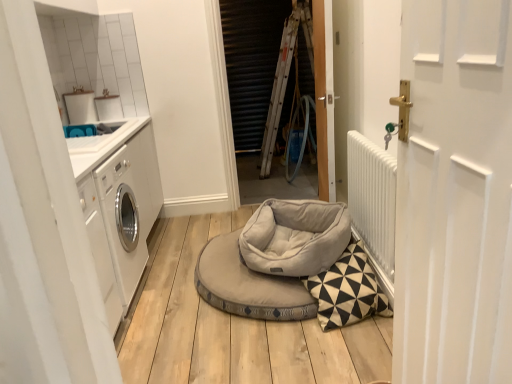
Locate an element on the screen. This screenshot has width=512, height=384. white glossy washing machine at left is located at coordinates (120, 210).

Find the location of a particular element. Image resolution: width=512 pixels, height=384 pixels. light gray plush dog bed at center, which is the second dog bed from bottom to top is located at coordinates (295, 237).

This screenshot has width=512, height=384. Describe the element at coordinates (324, 97) in the screenshot. I see `wooden door at center, the first door from the back` at that location.

This screenshot has width=512, height=384. What are the coordinates of `light gray fabric dog bed at center, the second dog bed when ordered from top to bottom` in the screenshot? It's located at (273, 259).

Find the location of a particular element. The image size is (512, 384). white glossy washing machine at left is located at coordinates (120, 210).

Considering the positions of objects white matte door at right, acting as the 1th door starting from the front, and light gray plush dog bed at center, which ranks as the 1th dog bed in top-to-bottom order, in the image provided, who is behind, white matte door at right, acting as the 1th door starting from the front, or light gray plush dog bed at center, which ranks as the 1th dog bed in top-to-bottom order,?

Positioned behind is light gray plush dog bed at center, which ranks as the 1th dog bed in top-to-bottom order.

From a real-world perspective, which is physically above, white matte door at right, acting as the 1th door starting from the front, or light gray plush dog bed at center, which is the second dog bed from bottom to top?

From a 3D spatial view, white matte door at right, acting as the 1th door starting from the front, is above.

From the image's perspective, is white matte door at right, acting as the 1th door starting from the front, on light gray plush dog bed at center, which is the second dog bed from bottom to top?

Yes.

Is white matte door at right, acting as the 1th door starting from the front, at the left side of light gray plush dog bed at center, which is the second dog bed from bottom to top?

No, white matte door at right, acting as the 1th door starting from the front, is not to the left of light gray plush dog bed at center, which is the second dog bed from bottom to top.

Locate an element on the screen. This screenshot has height=384, width=512. dog bed on the right of metallic silver screen door at center is located at coordinates (295, 237).

Would you say metallic silver screen door at center is a long distance from light gray plush dog bed at center, which is the second dog bed from bottom to top?

Indeed, metallic silver screen door at center is not near light gray plush dog bed at center, which is the second dog bed from bottom to top.

From the picture: Is metallic silver screen door at center outside of light gray plush dog bed at center, which ranks as the 1th dog bed in top-to-bottom order?

Yes, metallic silver screen door at center is outside of light gray plush dog bed at center, which ranks as the 1th dog bed in top-to-bottom order.

Can you tell me how much metallic silver screen door at center and light gray plush dog bed at center, which ranks as the 1th dog bed in top-to-bottom order, differ in facing direction?

Result: The angle between the facing direction of metallic silver screen door at center and the facing direction of light gray plush dog bed at center, which ranks as the 1th dog bed in top-to-bottom order, is 23.3 degrees.

Considering the sizes of light gray fabric dog bed at center, the second dog bed when ordered from top to bottom, and light gray plush dog bed at center, which ranks as the 1th dog bed in top-to-bottom order, in the image, is light gray fabric dog bed at center, the second dog bed when ordered from top to bottom, wider or thinner than light gray plush dog bed at center, which ranks as the 1th dog bed in top-to-bottom order,?

In the image, light gray fabric dog bed at center, the second dog bed when ordered from top to bottom, appears to be wider than light gray plush dog bed at center, which ranks as the 1th dog bed in top-to-bottom order.

From a real-world perspective, which object stands above the other?

From a 3D spatial view, light gray plush dog bed at center, which ranks as the 1th dog bed in top-to-bottom order, is above.

From the image's perspective, is light gray fabric dog bed at center, the second dog bed when ordered from top to bottom, above or below light gray plush dog bed at center, which is the second dog bed from bottom to top?

light gray fabric dog bed at center, the second dog bed when ordered from top to bottom, is situated lower than light gray plush dog bed at center, which is the second dog bed from bottom to top, in the image.

How different are the orientations of light gray fabric dog bed at center, marked as the first dog bed in a bottom-to-top arrangement, and light gray plush dog bed at center, which ranks as the 1th dog bed in top-to-bottom order, in degrees?

They differ by 66.3 degrees in their facing directions.

From a real-world perspective, between white textured radiator at right and light gray plush dog bed at center, which is the second dog bed from bottom to top, who is vertically higher?

white textured radiator at right, from a real-world perspective.

Is white textured radiator at right surrounding light gray plush dog bed at center, which ranks as the 1th dog bed in top-to-bottom order?

No, light gray plush dog bed at center, which ranks as the 1th dog bed in top-to-bottom order, is not a part of white textured radiator at right.

The width and height of the screenshot is (512, 384). Find the location of `dog bed that is the 1st object to the left of the white textured radiator at right, starting at the anchor`. dog bed that is the 1st object to the left of the white textured radiator at right, starting at the anchor is located at coordinates (295, 237).

Is white textured radiator at right wider or thinner than light gray plush dog bed at center, which is the second dog bed from bottom to top?

Clearly, white textured radiator at right has less width compared to light gray plush dog bed at center, which is the second dog bed from bottom to top.

Is metallic silver screen door at center in front of white textured radiator at right?

No, metallic silver screen door at center is behind white textured radiator at right.

Is metallic silver screen door at center far from white textured radiator at right?

Yes.

Is metallic silver screen door at center situated inside white textured radiator at right or outside?

metallic silver screen door at center is spatially situated outside white textured radiator at right.

Which point is more forward, (233, 134) or (379, 254)?

The point (379, 254) is in front.

Locate an element on the screen. This screenshot has width=512, height=384. washing machine that appears above the white matte door at right, acting as the 1th door starting from the front (from the image's perspective) is located at coordinates (120, 210).

Can you confirm if white glossy washing machine at left is smaller than white matte door at right, positioned as the 2th door in back-to-front order?

Incorrect, white glossy washing machine at left is not smaller in size than white matte door at right, positioned as the 2th door in back-to-front order.

Is white glossy washing machine at left at the right side of white matte door at right, positioned as the 2th door in back-to-front order?

In fact, white glossy washing machine at left is to the left of white matte door at right, positioned as the 2th door in back-to-front order.

Does light gray plush dog bed at center, which is the second dog bed from bottom to top, lie in front of white matte door at right, positioned as the 2th door in back-to-front order?

No, it is behind white matte door at right, positioned as the 2th door in back-to-front order.

Is light gray plush dog bed at center, which ranks as the 1th dog bed in top-to-bottom order, inside or outside of white matte door at right, positioned as the 2th door in back-to-front order?

light gray plush dog bed at center, which ranks as the 1th dog bed in top-to-bottom order, is outside white matte door at right, positioned as the 2th door in back-to-front order.

Could you tell me if light gray plush dog bed at center, which is the second dog bed from bottom to top, is facing white matte door at right, acting as the 1th door starting from the front?

No, light gray plush dog bed at center, which is the second dog bed from bottom to top, is not facing towards white matte door at right, acting as the 1th door starting from the front.

Considering the relative sizes of light gray plush dog bed at center, which is the second dog bed from bottom to top, and white matte door at right, acting as the 1th door starting from the front, in the image provided, is light gray plush dog bed at center, which is the second dog bed from bottom to top, thinner than white matte door at right, acting as the 1th door starting from the front,?

In fact, light gray plush dog bed at center, which is the second dog bed from bottom to top, might be wider than white matte door at right, acting as the 1th door starting from the front.

Where is `the 1st door to the right of the light gray plush dog bed at center, which is the second dog bed from bottom to top, counting from the anchor's position`? The image size is (512, 384). the 1st door to the right of the light gray plush dog bed at center, which is the second dog bed from bottom to top, counting from the anchor's position is located at coordinates (455, 195).

This screenshot has width=512, height=384. What are the coordinates of `screen door that is on the left side of light gray plush dog bed at center, which is the second dog bed from bottom to top` in the screenshot? It's located at (252, 66).

Based on the photo, considering their positions, is metallic silver screen door at center positioned further to white matte door at right, positioned as the 2th door in back-to-front order, than light gray fabric dog bed at center, marked as the first dog bed in a bottom-to-top arrangement?

metallic silver screen door at center is further to white matte door at right, positioned as the 2th door in back-to-front order.

From the image, which object appears to be farther from white matte door at right, positioned as the 2th door in back-to-front order, white glossy washing machine at left or metallic silver screen door at center?

metallic silver screen door at center is positioned further to the anchor white matte door at right, positioned as the 2th door in back-to-front order.

Based on their spatial positions, is light gray fabric dog bed at center, marked as the first dog bed in a bottom-to-top arrangement, or wooden door at center, placed as the 2th door when sorted from front to back, further from metallic silver screen door at center?

light gray fabric dog bed at center, marked as the first dog bed in a bottom-to-top arrangement, lies further to metallic silver screen door at center than the other object.

Which object lies nearer to the anchor point white textured radiator at right, metallic silver screen door at center or light gray fabric dog bed at center, the second dog bed when ordered from top to bottom?

light gray fabric dog bed at center, the second dog bed when ordered from top to bottom.

Estimate the real-world distances between objects in this image. Which object is further from white textured radiator at right, wooden door at center, the first door from the back, or light gray plush dog bed at center, which ranks as the 1th dog bed in top-to-bottom order?

wooden door at center, the first door from the back, lies further to white textured radiator at right than the other object.

Considering their positions, is white matte door at right, positioned as the 2th door in back-to-front order, positioned further to wooden door at center, placed as the 2th door when sorted from front to back, than white glossy washing machine at left?

white matte door at right, positioned as the 2th door in back-to-front order, is further to wooden door at center, placed as the 2th door when sorted from front to back.

In the scene shown: When comparing their distances from light gray plush dog bed at center, which ranks as the 1th dog bed in top-to-bottom order, does white glossy washing machine at left or white matte door at right, acting as the 1th door starting from the front, seem further?

Among the two, white matte door at right, acting as the 1th door starting from the front, is located further to light gray plush dog bed at center, which ranks as the 1th dog bed in top-to-bottom order.

When comparing their distances from wooden door at center, the first door from the back, does white textured radiator at right or white matte door at right, acting as the 1th door starting from the front, seem further?

Among the two, white matte door at right, acting as the 1th door starting from the front, is located further to wooden door at center, the first door from the back.

Identify the location of washing machine between white matte door at right, positioned as the 2th door in back-to-front order, and metallic silver screen door at center, along the z-axis. (120, 210).

Image resolution: width=512 pixels, height=384 pixels. I want to click on screen door between white glossy washing machine at left and wooden door at center, placed as the 2th door when sorted from front to back, so click(x=252, y=66).

Identify the location of radiator positioned between white matte door at right, acting as the 1th door starting from the front, and light gray fabric dog bed at center, the second dog bed when ordered from top to bottom, from near to far. The height and width of the screenshot is (384, 512). (372, 199).

Locate an element on the screen. The width and height of the screenshot is (512, 384). dog bed between white matte door at right, positioned as the 2th door in back-to-front order, and light gray fabric dog bed at center, the second dog bed when ordered from top to bottom, along the z-axis is located at coordinates (295, 237).